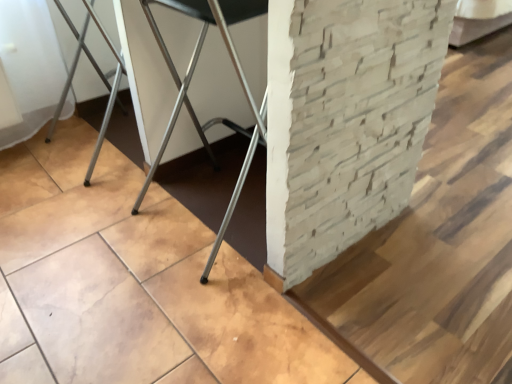
Measure the distance between metallic silver chair at center and camera.

35.28 inches.

The width and height of the screenshot is (512, 384). Identify the location of metallic silver chair at center. (190, 81).

Looking at this image, in order to face metallic silver chair at center, should I rotate leftwards or rightwards?

You should look left and rotate roughly 6.935 degrees.

Describe the element at coordinates (190, 81) in the screenshot. I see `metallic silver chair at center` at that location.

The height and width of the screenshot is (384, 512). What do you see at coordinates (133, 283) in the screenshot?
I see `light beige stone pillar at center` at bounding box center [133, 283].

This screenshot has height=384, width=512. In order to click on light beige stone pillar at center in this screenshot , I will do `click(133, 283)`.

In order to face light beige stone pillar at center, should I rotate leftwards or rightwards?

To face it directly, rotate right by 17.552 degrees.

Where is `metallic silver chair at center`? The width and height of the screenshot is (512, 384). metallic silver chair at center is located at coordinates (190, 81).

Does metallic silver chair at center appear on the left side of light beige stone pillar at center?

Yes, metallic silver chair at center is to the left of light beige stone pillar at center.

Considering the positions of objects metallic silver chair at center and light beige stone pillar at center in the image provided, who is in front, metallic silver chair at center or light beige stone pillar at center?

light beige stone pillar at center is more forward.

Is point (206, 32) behind point (193, 333)?

Yes, it is behind point (193, 333).

From the image's perspective, does metallic silver chair at center appear higher than light beige stone pillar at center?

No, from the image's perspective, metallic silver chair at center is not over light beige stone pillar at center.

From a real-world perspective, is metallic silver chair at center below light beige stone pillar at center?

Actually, metallic silver chair at center is physically above light beige stone pillar at center in the real world.

Between metallic silver chair at center and light beige stone pillar at center, which one has smaller width?

metallic silver chair at center.

In the scene shown: Between metallic silver chair at center and light beige stone pillar at center, which one has more height?

metallic silver chair at center.

Based on the photo, does metallic silver chair at center have a smaller size compared to light beige stone pillar at center?

Yes.

Is metallic silver chair at center completely or partially outside of light beige stone pillar at center?

Yes.

Are metallic silver chair at center and light beige stone pillar at center located far from each other?

No, there isn't a large distance between metallic silver chair at center and light beige stone pillar at center.

Is metallic silver chair at center facing towards light beige stone pillar at center?

Yes, metallic silver chair at center is turned towards light beige stone pillar at center.

How much distance is there between metallic silver chair at center and light beige stone pillar at center?

metallic silver chair at center and light beige stone pillar at center are 32.48 centimeters apart.

Locate an element on the screen. concrete on the right of metallic silver chair at center is located at coordinates (133, 283).

Considering the relative positions of light beige stone pillar at center and metallic silver chair at center in the image provided, is light beige stone pillar at center to the left of metallic silver chair at center from the viewer's perspective?

Incorrect, light beige stone pillar at center is not on the left side of metallic silver chair at center.

Is the depth of light beige stone pillar at center less than that of metallic silver chair at center?

Yes, it is in front of metallic silver chair at center.

Is point (87, 227) more distant than point (265, 131)?

Yes, it is behind point (265, 131).

From the image's perspective, is light beige stone pillar at center located above metallic silver chair at center?

Indeed, from the image's perspective, light beige stone pillar at center is shown above metallic silver chair at center.

From a real-world perspective, who is located higher, light beige stone pillar at center or metallic silver chair at center?

metallic silver chair at center, from a real-world perspective.

Is light beige stone pillar at center wider than metallic silver chair at center?

Indeed, light beige stone pillar at center has a greater width compared to metallic silver chair at center.

In terms of height, does light beige stone pillar at center look taller or shorter compared to metallic silver chair at center?

In the image, light beige stone pillar at center appears to be shorter than metallic silver chair at center.

Is light beige stone pillar at center bigger or smaller than metallic silver chair at center?

light beige stone pillar at center is bigger than metallic silver chair at center.

Is light beige stone pillar at center completely or partially outside of metallic silver chair at center?

That's correct, light beige stone pillar at center is outside of metallic silver chair at center.

Is there a large distance between light beige stone pillar at center and metallic silver chair at center?

light beige stone pillar at center is actually quite close to metallic silver chair at center.

Does light beige stone pillar at center turn towards metallic silver chair at center?

No.

How much distance is there between light beige stone pillar at center and metallic silver chair at center?

A distance of 12.79 inches exists between light beige stone pillar at center and metallic silver chair at center.

The height and width of the screenshot is (384, 512). I want to click on concrete that appears in front of the metallic silver chair at center, so click(133, 283).

Locate an element on the screen. The image size is (512, 384). concrete directly beneath the metallic silver chair at center (from a real-world perspective) is located at coordinates (133, 283).

This screenshot has height=384, width=512. I want to click on concrete in front of the metallic silver chair at center, so click(x=133, y=283).